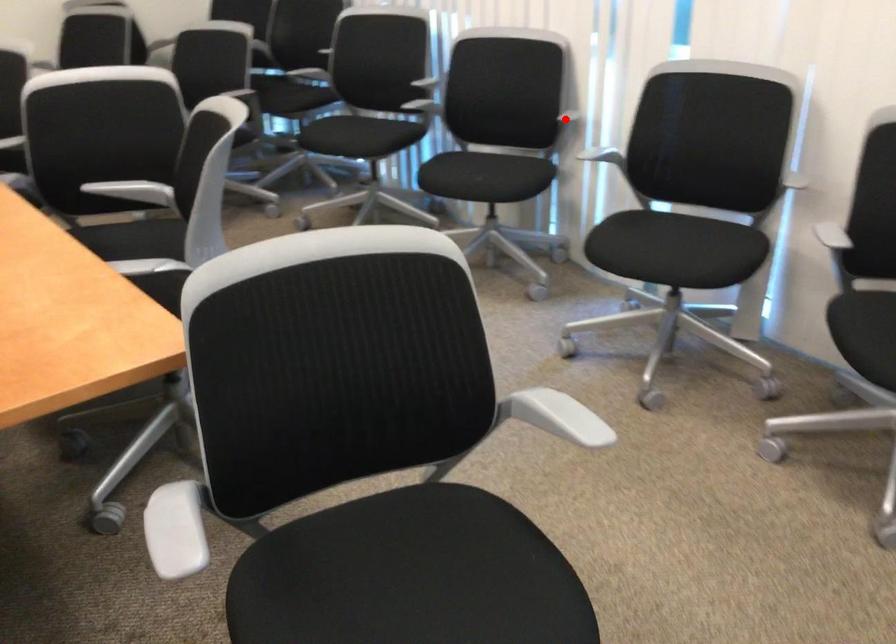
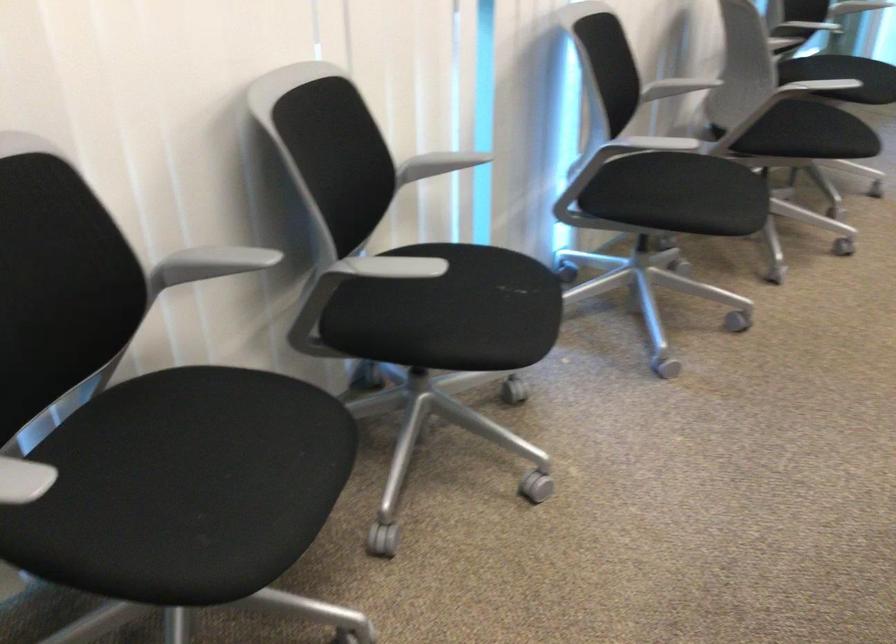
Question: I am providing you with two images of the same scene from different viewpoints. Given a red point in image1, look at the same physical point in image2. Is it:

Choices:
 (A) Closer to the viewpoint
 (B) Farther from the viewpoint

Answer: (A)